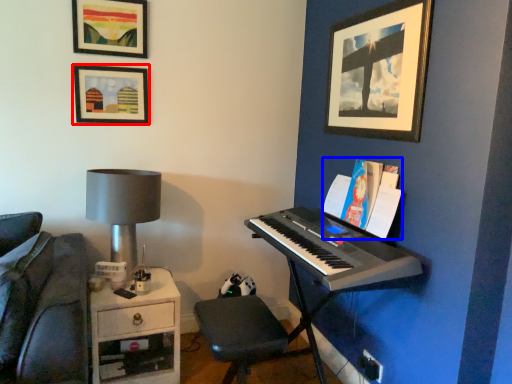
Question: Among these objects, which one is farthest to the camera, picture frame (highlighted by a red box) or paperback book (highlighted by a blue box)?

Choices:
 (A) picture frame
 (B) paperback book

Answer: (A)